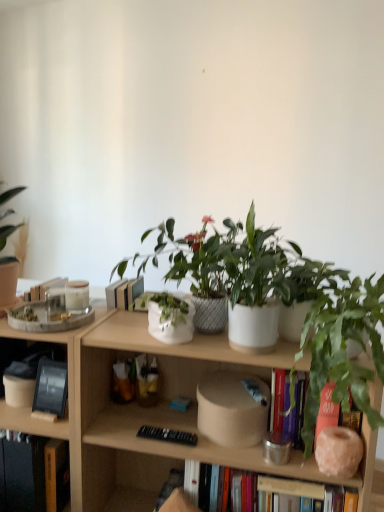
Where is `hardcover book at lower left, arranged as the first book when ordered from the bottom`? This screenshot has width=384, height=512. hardcover book at lower left, arranged as the first book when ordered from the bottom is located at coordinates (36, 474).

What is the approximate width of wooden bookcase at center?

It is 4.26 feet.

In order to click on green matte houseplant at right in this screenshot , I will do `click(343, 349)`.

This screenshot has width=384, height=512. What are the coordinates of `black matte tablet at left, the first book when ordered from top to bottom` in the screenshot? It's located at (50, 388).

Is wooden bookcase at center facing away from hardcover book at lower left, arranged as the first book when ordered from the bottom?

wooden bookcase at center does not have its back to hardcover book at lower left, arranged as the first book when ordered from the bottom.

Can you confirm if wooden bookcase at center is wider than hardcover book at lower left, arranged as the first book when ordered from the bottom?

Yes, wooden bookcase at center is wider than hardcover book at lower left, arranged as the first book when ordered from the bottom.

How far apart are wooden bookcase at center and hardcover book at lower left, arranged as the 2th book when viewed from the top?

The distance of wooden bookcase at center from hardcover book at lower left, arranged as the 2th book when viewed from the top, is 10.74 inches.

From the picture: Is the depth of wooden bookcase at center greater than that of hardcover book at lower left, arranged as the 2th book when viewed from the top?

No, wooden bookcase at center is closer to the viewer.

From a real-world perspective, who is located higher, green matte houseplant at right or black matte tablet at left, the first book when ordered from top to bottom?

In real-world perspective, green matte houseplant at right is above.

At what (x,y) coordinates should I click in order to perform the action: click on houseplant located in front of the black matte tablet at left, the first book when ordered from top to bottom. Please return your answer as a coordinate pair (x, y). The image size is (384, 512). Looking at the image, I should click on (343, 349).

Can you confirm if green matte houseplant at right is wider than black matte tablet at left, which ranks as the 2th book in bottom-to-top order?

Yes.

Are green matte houseplant at right and black matte tablet at left, the first book when ordered from top to bottom, far apart?

No.

In the scene shown: Does wooden bookcase at center have a lesser width compared to black matte tablet at left, which ranks as the 2th book in bottom-to-top order?

Incorrect, the width of wooden bookcase at center is not less than that of black matte tablet at left, which ranks as the 2th book in bottom-to-top order.

Does wooden bookcase at center appear on the right side of black matte tablet at left, the first book when ordered from top to bottom?

Yes.

Considering the relative sizes of wooden bookcase at center and black matte tablet at left, the first book when ordered from top to bottom, in the image provided, is wooden bookcase at center shorter than black matte tablet at left, the first book when ordered from top to bottom,?

No, wooden bookcase at center is not shorter than black matte tablet at left, the first book when ordered from top to bottom.

Is point (175, 365) more distant than point (51, 414)?

Yes.

From the wooden bookcase at center, count the 2nd book to the left and point to it. Please provide its 2D coordinates.

[(36, 474)]

Which object is wider, hardcover book at lower left, arranged as the 2th book when viewed from the top, or wooden bookcase at center?

With larger width is wooden bookcase at center.

Between hardcover book at lower left, arranged as the first book when ordered from the bottom, and wooden bookcase at center, which one has more height?

wooden bookcase at center.

Considering the relative positions of black matte tablet at left, which ranks as the 2th book in bottom-to-top order, and green matte houseplant at right in the image provided, is black matte tablet at left, which ranks as the 2th book in bottom-to-top order, to the right of green matte houseplant at right from the viewer's perspective?

No, black matte tablet at left, which ranks as the 2th book in bottom-to-top order, is not to the right of green matte houseplant at right.

In the scene shown: Is black matte tablet at left, the first book when ordered from top to bottom, not inside green matte houseplant at right?

Yes, black matte tablet at left, the first book when ordered from top to bottom, is located beyond the bounds of green matte houseplant at right.

From the image's perspective, which one is positioned higher, black matte tablet at left, which ranks as the 2th book in bottom-to-top order, or green matte houseplant at right?

From the image's view, green matte houseplant at right is above.

Based on the photo, would you say hardcover book at lower left, arranged as the first book when ordered from the bottom, is part of green matte houseplant at right's contents?

No.

Considering the relative sizes of green matte houseplant at right and hardcover book at lower left, arranged as the 2th book when viewed from the top, in the image provided, is green matte houseplant at right wider than hardcover book at lower left, arranged as the 2th book when viewed from the top,?

Yes.

Is green matte houseplant at right looking in the opposite direction of hardcover book at lower left, arranged as the first book when ordered from the bottom?

No.

Can you confirm if green matte houseplant at right is taller than hardcover book at lower left, arranged as the first book when ordered from the bottom?

Yes, green matte houseplant at right is taller than hardcover book at lower left, arranged as the first book when ordered from the bottom.

Is point (55, 384) in front of point (41, 445)?

No, it is behind (41, 445).

Which of these two, black matte tablet at left, which ranks as the 2th book in bottom-to-top order, or hardcover book at lower left, arranged as the 2th book when viewed from the top, stands taller?

hardcover book at lower left, arranged as the 2th book when viewed from the top.

Looking at this image, would you consider black matte tablet at left, which ranks as the 2th book in bottom-to-top order, to be distant from hardcover book at lower left, arranged as the first book when ordered from the bottom?

black matte tablet at left, which ranks as the 2th book in bottom-to-top order, is actually quite close to hardcover book at lower left, arranged as the first book when ordered from the bottom.

From a real-world perspective, does black matte tablet at left, which ranks as the 2th book in bottom-to-top order, stand above hardcover book at lower left, arranged as the first book when ordered from the bottom?

Yes, from a real-world perspective, black matte tablet at left, which ranks as the 2th book in bottom-to-top order, is over hardcover book at lower left, arranged as the first book when ordered from the bottom

The height and width of the screenshot is (512, 384). In order to click on book that appears below the wooden bookcase at center (from a real-world perspective) in this screenshot , I will do pyautogui.click(x=36, y=474).

You are a GUI agent. You are given a task and a screenshot of the screen. Output one action in this format:
    pyautogui.click(x=<x>, y=<y>)
    Task: Click on the 2nd book behind the green matte houseplant at right
    The height and width of the screenshot is (512, 384).
    Given the screenshot: What is the action you would take?
    pyautogui.click(x=50, y=388)

From the image, which object appears to be farther from hardcover book at lower left, arranged as the 2th book when viewed from the top, black matte tablet at left, which ranks as the 2th book in bottom-to-top order, or green matte houseplant at right?

green matte houseplant at right is further to hardcover book at lower left, arranged as the 2th book when viewed from the top.

When comparing their distances from hardcover book at lower left, arranged as the 2th book when viewed from the top, does green matte houseplant at right or black matte tablet at left, which ranks as the 2th book in bottom-to-top order, seem closer?

The object closer to hardcover book at lower left, arranged as the 2th book when viewed from the top, is black matte tablet at left, which ranks as the 2th book in bottom-to-top order.

Based on their spatial positions, is wooden bookcase at center or hardcover book at lower left, arranged as the first book when ordered from the bottom, further from green matte houseplant at right?

hardcover book at lower left, arranged as the first book when ordered from the bottom, is positioned further to the anchor green matte houseplant at right.

Based on their spatial positions, is wooden bookcase at center or black matte tablet at left, which ranks as the 2th book in bottom-to-top order, further from hardcover book at lower left, arranged as the 2th book when viewed from the top?

wooden bookcase at center lies further to hardcover book at lower left, arranged as the 2th book when viewed from the top, than the other object.

Considering their positions, is black matte tablet at left, the first book when ordered from top to bottom, positioned further to wooden bookcase at center than green matte houseplant at right?

green matte houseplant at right is positioned further to the anchor wooden bookcase at center.

Considering their positions, is hardcover book at lower left, arranged as the first book when ordered from the bottom, positioned further to black matte tablet at left, the first book when ordered from top to bottom, than green matte houseplant at right?

green matte houseplant at right is positioned further to the anchor black matte tablet at left, the first book when ordered from top to bottom.

Which object lies further to the anchor point black matte tablet at left, which ranks as the 2th book in bottom-to-top order, wooden bookcase at center or green matte houseplant at right?

Among the two, green matte houseplant at right is located further to black matte tablet at left, which ranks as the 2th book in bottom-to-top order.

Which object lies nearer to the anchor point wooden bookcase at center, hardcover book at lower left, arranged as the 2th book when viewed from the top, or black matte tablet at left, which ranks as the 2th book in bottom-to-top order?

hardcover book at lower left, arranged as the 2th book when viewed from the top, is closer to wooden bookcase at center.

Find the location of a particular element. bookcase located between hardcover book at lower left, arranged as the first book when ordered from the bottom, and green matte houseplant at right in the left-right direction is located at coordinates (139, 409).

Locate an element on the screen. This screenshot has height=512, width=384. book situated between hardcover book at lower left, arranged as the first book when ordered from the bottom, and wooden bookcase at center from left to right is located at coordinates (50, 388).

At what (x,y) coordinates should I click in order to perform the action: click on book situated between hardcover book at lower left, arranged as the first book when ordered from the bottom, and green matte houseplant at right from left to right. Please return your answer as a coordinate pair (x, y). Looking at the image, I should click on (50, 388).

The width and height of the screenshot is (384, 512). I want to click on bookcase between black matte tablet at left, the first book when ordered from top to bottom, and green matte houseplant at right from left to right, so click(x=139, y=409).